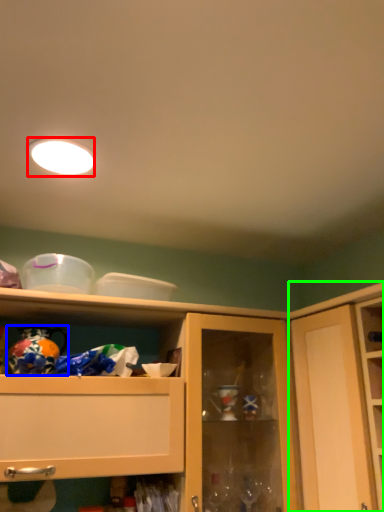
Question: Which object is positioned closest to lighting (highlighted by a red box)? Select from toy (highlighted by a blue box) and cupboard (highlighted by a green box).

Choices:
 (A) toy
 (B) cupboard

Answer: (A)